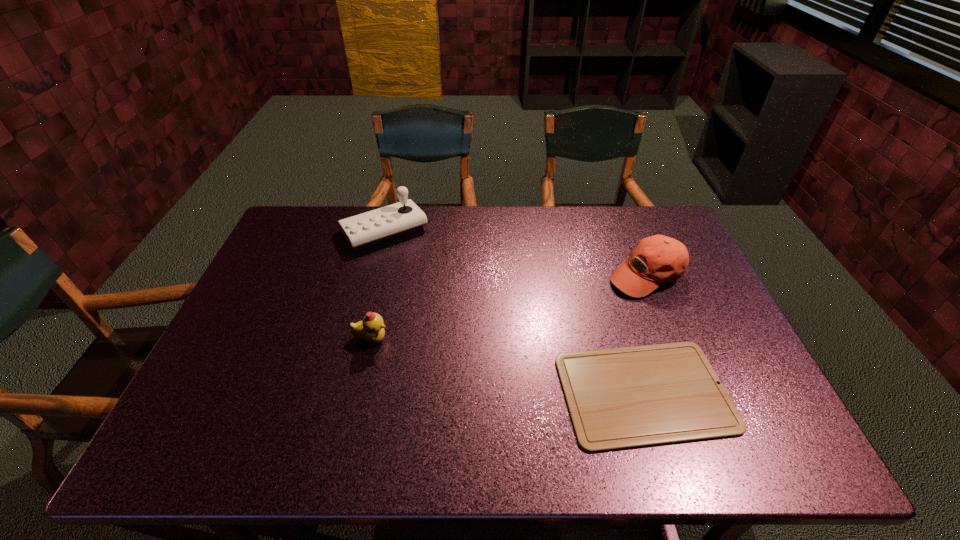
Locate an element on the screen. Image resolution: width=960 pixels, height=540 pixels. joystick is located at coordinates (373, 227).

Image resolution: width=960 pixels, height=540 pixels. Find the location of `baseball cap`. baseball cap is located at coordinates (655, 259).

Identify the location of the third tallest object. This screenshot has width=960, height=540. (371, 329).

You are a GUI agent. You are given a task and a screenshot of the screen. Output one action in this format:
    pyautogui.click(x=<x>, y=<y>)
    Task: Click on the chopping board
    The image size is (960, 540).
    Given the screenshot: What is the action you would take?
    pyautogui.click(x=621, y=398)

This screenshot has height=540, width=960. I want to click on vacant space located on the front of the joystick, so click(364, 308).

Where is `free point located on the left of the baseball cap`? free point located on the left of the baseball cap is located at coordinates (538, 275).

Where is `vacant area situated 0.230m on the front-facing side of the duckling`? This screenshot has width=960, height=540. vacant area situated 0.230m on the front-facing side of the duckling is located at coordinates (478, 339).

Find the location of `vacant point located 0.160m on the left of the chopping board`. vacant point located 0.160m on the left of the chopping board is located at coordinates (492, 393).

I want to click on object located at the far edge, so click(x=373, y=227).

Locate an element on the screen. This screenshot has width=960, height=540. object that is positioned at the near edge is located at coordinates pos(621,398).